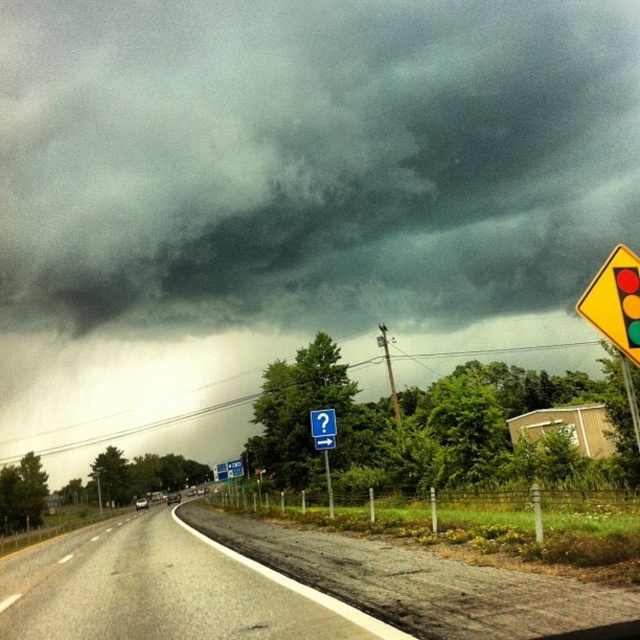
Question: Is yellow plastic traffic light at right smaller than brushed metal signpost at center?

Choices:
 (A) no
 (B) yes

Answer: (A)

Question: Which of the following is the farthest from the observer?

Choices:
 (A) (35, 604)
 (B) (314, 422)
 (C) (332, 502)

Answer: (B)

Question: Does blue plastic sign at center appear on the left side of brushed metal signpost at center?

Choices:
 (A) no
 (B) yes

Answer: (B)

Question: Can you confirm if blue plastic sign at center is thinner than brushed metal signpost at center?

Choices:
 (A) yes
 (B) no

Answer: (B)

Question: Which object appears farthest from the camera in this image?

Choices:
 (A) brushed metal signpost at center
 (B) yellow plastic traffic light at right
 (C) blue plastic sign at center

Answer: (C)

Question: Considering the real-world distances, which object is farthest from the brushed metal signpost at center?

Choices:
 (A) asphalt road at lower left
 (B) blue plastic sign at center

Answer: (A)